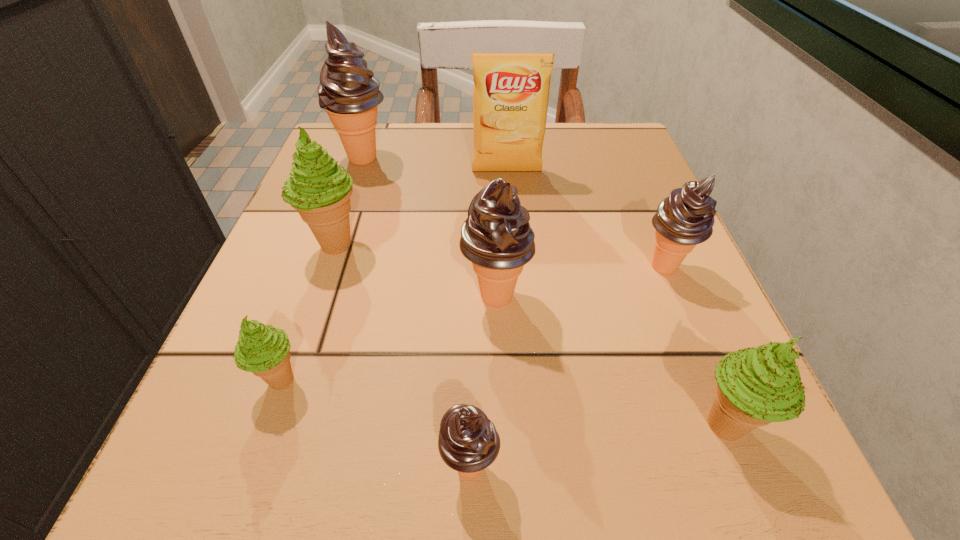
Identify which chocolate icecream is located as the nearest to the rightmost chocolate icecream. Please provide its 2D coordinates. Your answer should be formatted as a tuple, i.e. [(x, y)], where the tuple contains the x and y coordinates of a point satisfying the conditions above.

[(496, 237)]

The height and width of the screenshot is (540, 960). I want to click on chocolate icecream object that ranks as the closest to the smallest green icecream, so click(x=468, y=442).

Identify the location of green icecream object that ranks as the closest to the smallest chocolate icecream. This screenshot has height=540, width=960. (261, 349).

Where is `the second closest green icecream relative to the leftmost chocolate icecream`? This screenshot has height=540, width=960. the second closest green icecream relative to the leftmost chocolate icecream is located at coordinates (261, 349).

Find the location of a particular element. free location that satisfies the following two spatial constraints: 1. on the back side of the nearest chocolate icecream; 2. on the left side of the second biggest chocolate icecream is located at coordinates (472, 296).

Locate an element on the screen. vacant area that satisfies the following two spatial constraints: 1. on the front of the rightmost green icecream with the logo; 2. on the left side of the crisp (potato chip) is located at coordinates (526, 425).

Where is `free space that satisfies the following two spatial constraints: 1. on the front of the crisp (potato chip) with the logo; 2. on the left side of the third biggest chocolate icecream`? The width and height of the screenshot is (960, 540). free space that satisfies the following two spatial constraints: 1. on the front of the crisp (potato chip) with the logo; 2. on the left side of the third biggest chocolate icecream is located at coordinates (515, 268).